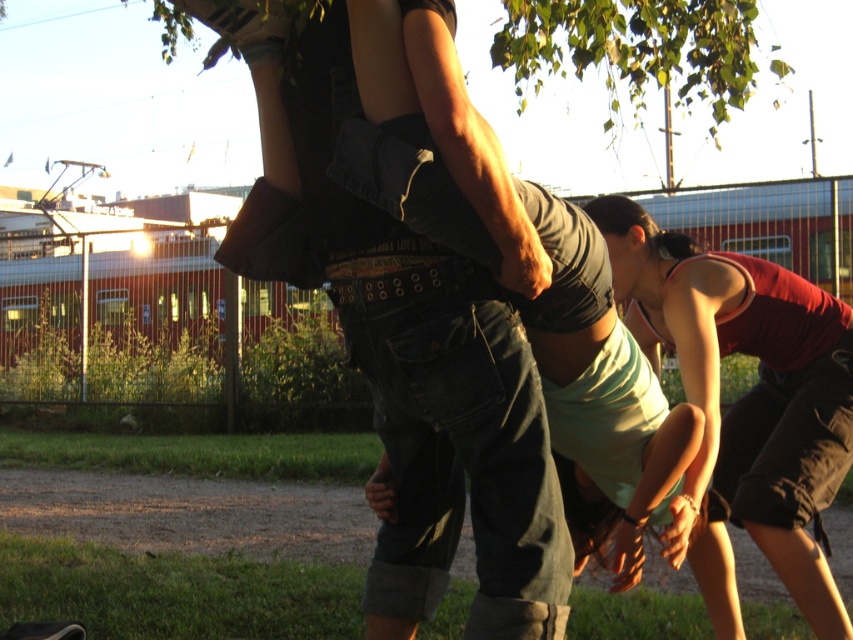
You are planning to place a large decorative rock that is 1.2 meters wide between the denim jeans at center and the green leafy tree at upper center. Based on their widths, will the rock fit between them without overlapping either object?

The denim jeans at center is narrower than the green leafy tree at upper center. Since the rock is 1.2 meters wide, but the description only compares their widths without providing exact measurements, it is unclear if the space between them can accommodate the rock without overlapping. More information about the actual widths or the distance between the objects is needed to determine this.

You are a photographer standing at the camera position. You want to capture a closeup of the point at coordinate point (418, 544) and point (795, 490). Which point will appear larger in your photo?

Point (418, 544) is closer to the camera than point (795, 490), so it will appear larger in the photo.

You are a photographer positioned at the camera. You want to capture a closeup of the point at coordinates point (708, 282) and point (733, 36). Which point should you focus on to ensure it appears larger in the photo?

Point (708, 282) is closer to the camera than point (733, 36), so focusing on point (708, 282) will make it appear larger in the photo.